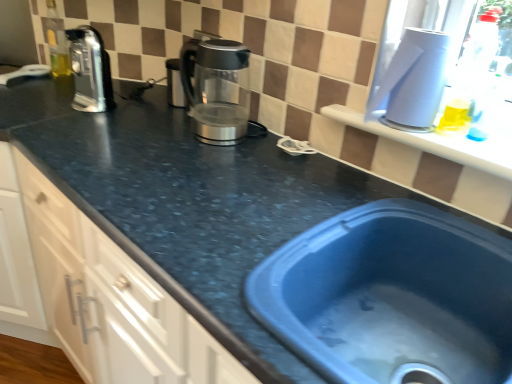
Question: Is point (439, 49) closer or farther from the camera than point (227, 100)?

Choices:
 (A) closer
 (B) farther

Answer: (A)

Question: Is white plastic container at upper right, placed as the 1th appliance when sorted from right to left, to the left or to the right of sleek metallic kettle at center in the image?

Choices:
 (A) left
 (B) right

Answer: (B)

Question: Which object is positioned closest to the satin silver coffee pot at upper left?

Choices:
 (A) white plastic container at upper right, placed as the 1th appliance when sorted from right to left
 (B) satin silver kettle at center, the 1th appliance viewed from the left
 (C) matte black countertop at left
 (D) blue plastic sink at lower right
 (E) sleek metallic kettle at center

Answer: (B)

Question: Which of these objects is positioned closest to the blue plastic sink at lower right?

Choices:
 (A) sleek metallic kettle at center
 (B) white plastic container at upper right, marked as the second appliance in a back-to-front arrangement
 (C) matte black countertop at left
 (D) satin silver coffee pot at upper left
 (E) satin silver kettle at center, the 1th appliance viewed from the left

Answer: (B)